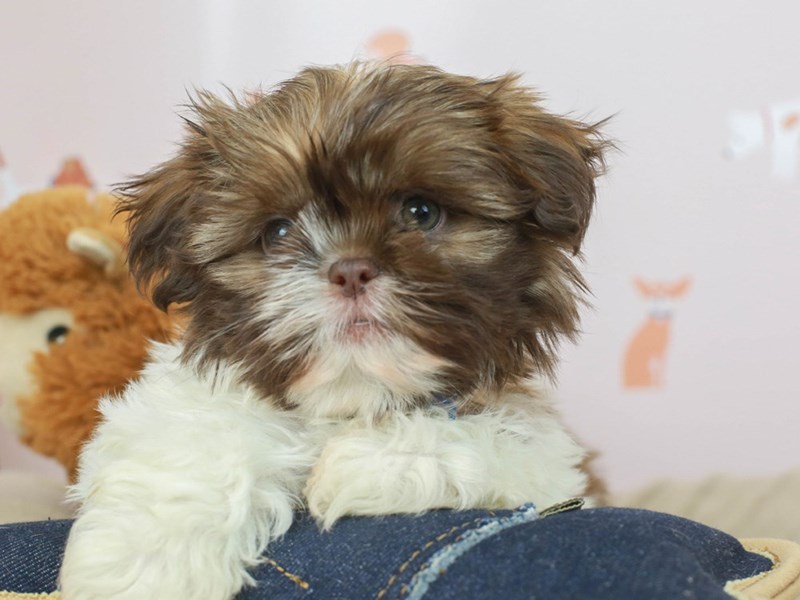
This screenshot has height=600, width=800. Find the location of `white background wall`. white background wall is located at coordinates (674, 150).